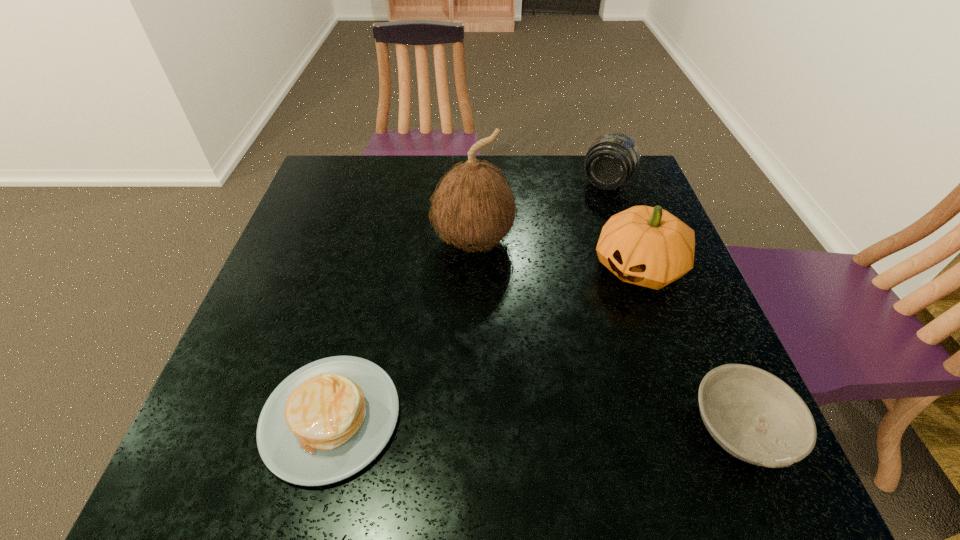
Image resolution: width=960 pixels, height=540 pixels. What are the coordinates of `vacant space located 0.290m on the surface of the tallest object` in the screenshot? It's located at (477, 380).

At what (x,y) coordinates should I click in order to perform the action: click on vacant space situated on the surface of the tallest object. Please return your answer as a coordinate pair (x, y). The height and width of the screenshot is (540, 960). Looking at the image, I should click on (477, 366).

At what (x,y) coordinates should I click in order to perform the action: click on free space located at the front element of the farthest object. Please return your answer as a coordinate pair (x, y). The width and height of the screenshot is (960, 540). Looking at the image, I should click on (565, 256).

Image resolution: width=960 pixels, height=540 pixels. I want to click on free space located 0.400m at the front element of the farthest object, so click(546, 292).

Locate an element on the screen. The height and width of the screenshot is (540, 960). vacant region located at the front element of the farthest object is located at coordinates (588, 217).

The width and height of the screenshot is (960, 540). I want to click on blank space located on the side of the fourth shortest object with the carved face, so click(605, 308).

Identify the location of vacant space located 0.290m on the side of the fourth shortest object with the carved face. The width and height of the screenshot is (960, 540). (541, 384).

Identify the location of free spot located 0.170m on the side of the fourth shortest object with the carved face. The width and height of the screenshot is (960, 540). (575, 343).

You are a GUI agent. You are given a task and a screenshot of the screen. Output one action in this format:
    pyautogui.click(x=<x>, y=<y>)
    Task: Click on the object located in the far edge section of the desktop
    The width and height of the screenshot is (960, 540).
    Given the screenshot: What is the action you would take?
    pyautogui.click(x=612, y=159)

Locate an element on the screen. The width and height of the screenshot is (960, 540). pancake that is positioned at the near edge is located at coordinates (328, 420).